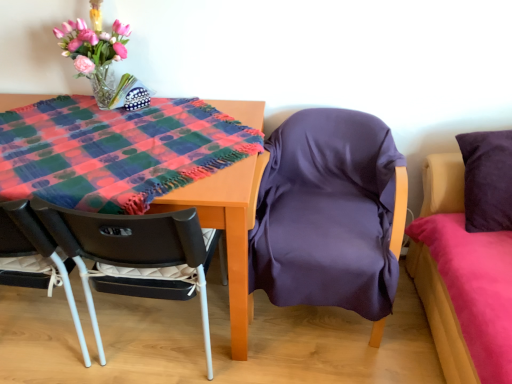
Question: Is wooden table at center looking in the opposite direction of matte black chair at lower left, which appears as the 2th chair when viewed from the right?

Choices:
 (A) no
 (B) yes

Answer: (B)

Question: Does wooden table at center come behind matte black chair at lower left, which is counted as the 1th chair, starting from the left?

Choices:
 (A) no
 (B) yes

Answer: (A)

Question: Is wooden table at center at the right side of matte black chair at lower left, which is counted as the 1th chair, starting from the left?

Choices:
 (A) yes
 (B) no

Answer: (B)

Question: From a real-world perspective, is wooden table at center on top of matte black chair at lower left, which appears as the 2th chair when viewed from the right?

Choices:
 (A) no
 (B) yes

Answer: (B)

Question: Does wooden table at center contain matte black chair at lower left, which appears as the 2th chair when viewed from the right?

Choices:
 (A) no
 (B) yes

Answer: (A)

Question: From their relative heights in the image, would you say matte black chair at lower left, which is counted as the 1th chair, starting from the left, is taller or shorter than purple satin chair at center, the 2th chair when ordered from left to right?

Choices:
 (A) tall
 (B) short

Answer: (B)

Question: Visually, is matte black chair at lower left, which appears as the 2th chair when viewed from the right, positioned to the left or to the right of purple satin chair at center, the 2th chair when ordered from left to right?

Choices:
 (A) right
 (B) left

Answer: (B)

Question: Is matte black chair at lower left, which is counted as the 1th chair, starting from the left, wider or thinner than purple satin chair at center, the 2th chair when ordered from left to right?

Choices:
 (A) wide
 (B) thin

Answer: (B)

Question: From a real-world perspective, is matte black chair at lower left, which appears as the 2th chair when viewed from the right, positioned above or below purple satin chair at center, the 2th chair when ordered from left to right?

Choices:
 (A) above
 (B) below

Answer: (B)

Question: Considering the relative positions of matte black chair at lower left, which is counted as the 1th chair, starting from the left, and purple satin bed at right in the image provided, is matte black chair at lower left, which is counted as the 1th chair, starting from the left, to the left or to the right of purple satin bed at right?

Choices:
 (A) left
 (B) right

Answer: (A)

Question: Is point (176, 256) closer or farther from the camera than point (500, 213)?

Choices:
 (A) farther
 (B) closer

Answer: (B)

Question: Is matte black chair at lower left, which appears as the 2th chair when viewed from the right, inside the boundaries of purple satin bed at right, or outside?

Choices:
 (A) inside
 (B) outside

Answer: (B)

Question: Is matte black chair at lower left, which is counted as the 1th chair, starting from the left, taller or shorter than purple satin bed at right?

Choices:
 (A) tall
 (B) short

Answer: (B)

Question: Considering the positions of wooden table at center and purple satin chair at center, marked as the first chair in a right-to-left arrangement, in the image, is wooden table at center taller or shorter than purple satin chair at center, marked as the first chair in a right-to-left arrangement,?

Choices:
 (A) tall
 (B) short

Answer: (B)

Question: Is wooden table at center bigger or smaller than purple satin chair at center, marked as the first chair in a right-to-left arrangement?

Choices:
 (A) small
 (B) big

Answer: (A)